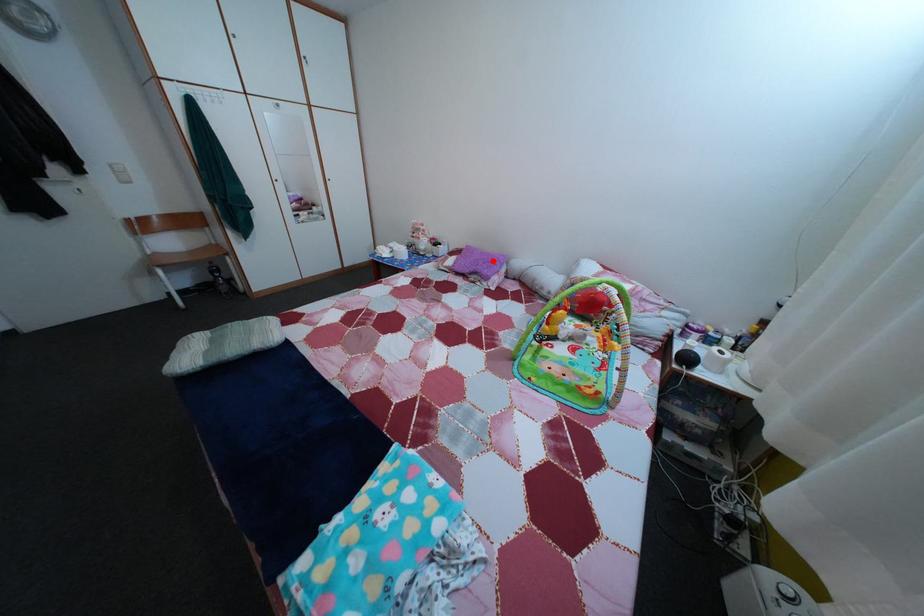
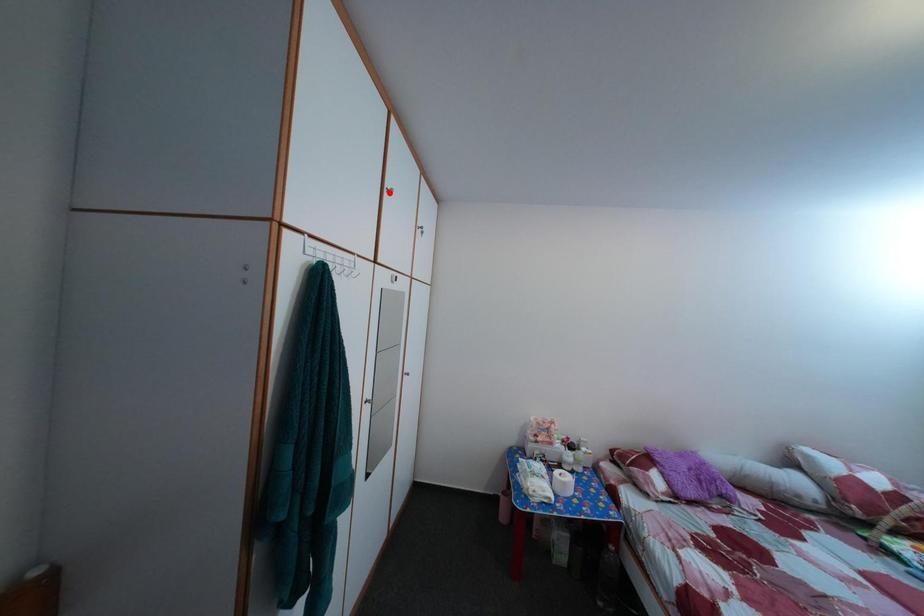
I am providing you with two images of the same scene from different viewpoints. A red point is marked on the first image and another point is marked on the second image. Does the point marked in image1 correspond to the same location as the one in image2?

No